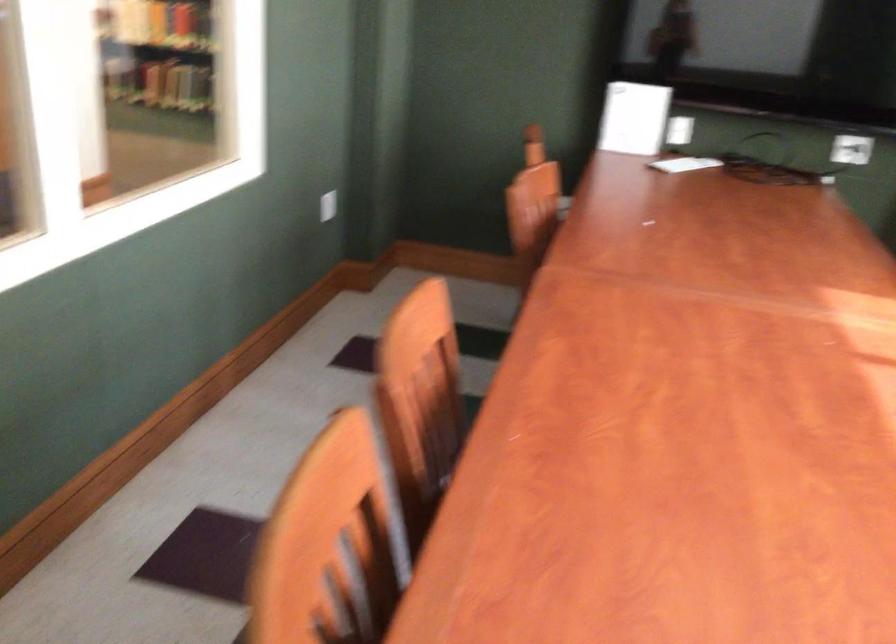
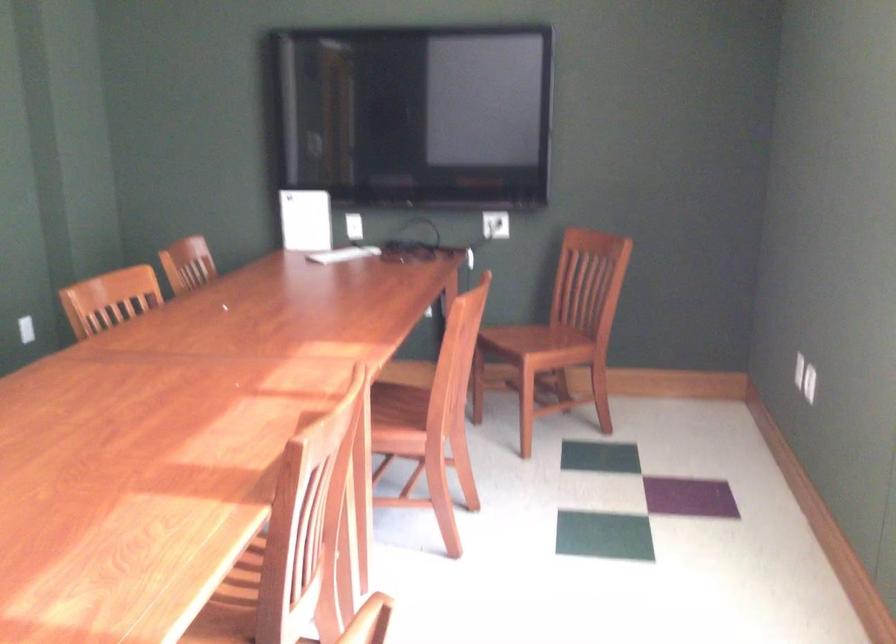
Question: The images are taken continuously from a first-person perspective. In which direction are you moving?

Choices:
 (A) Left
 (B) Right
 (C) Forward
 (D) Backward

Answer: (B)